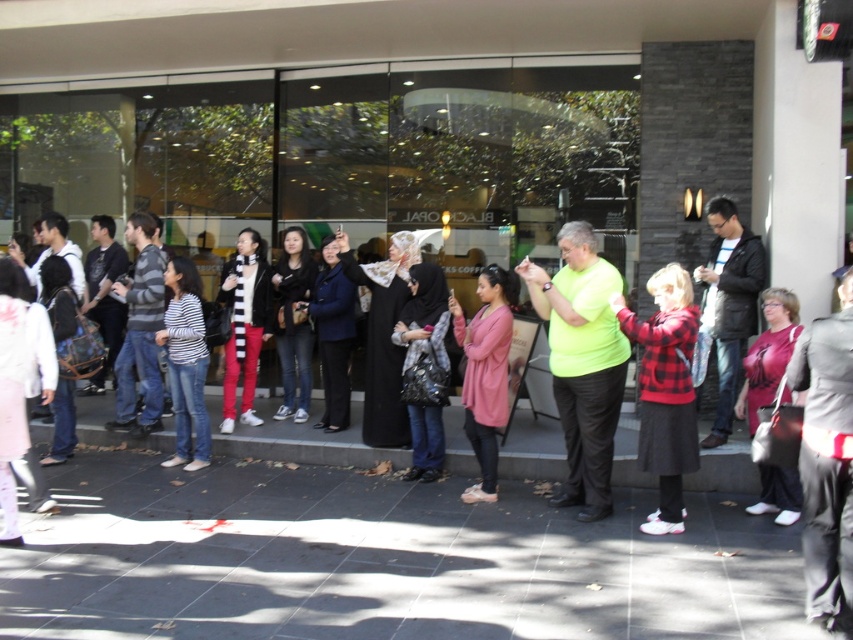
Question: Is striped fabric shirt at center below black and white striped scarf at center?

Choices:
 (A) yes
 (B) no

Answer: (A)

Question: Which point is farther to the camera?

Choices:
 (A) striped sweater at center
 (B) matte blue coat at center
 (C) matte black jacket at right

Answer: (B)

Question: Which point appears closest to the camera in this image?

Choices:
 (A) (833, 593)
 (B) (138, 348)
 (C) (184, 412)
 (D) (439, 438)

Answer: (A)

Question: Can you confirm if smooth concrete pavement at center is smaller than plaid wool sweater at center?

Choices:
 (A) yes
 (B) no

Answer: (B)

Question: In this image, where is matte black jacket at right located relative to striped fabric shirt at center?

Choices:
 (A) right
 (B) left

Answer: (A)

Question: Which object is closer to the camera taking this photo?

Choices:
 (A) matte black hijab at center
 (B) black leather jacket at center

Answer: (A)